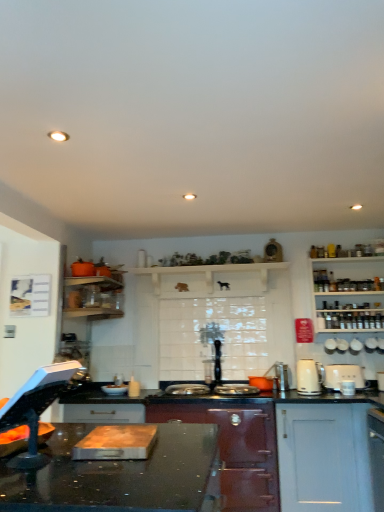
The width and height of the screenshot is (384, 512). I want to click on vacant region to the left of white glossy kettle at center-right, placed as the 1th kitchen appliance when sorted from left to right, so click(x=297, y=394).